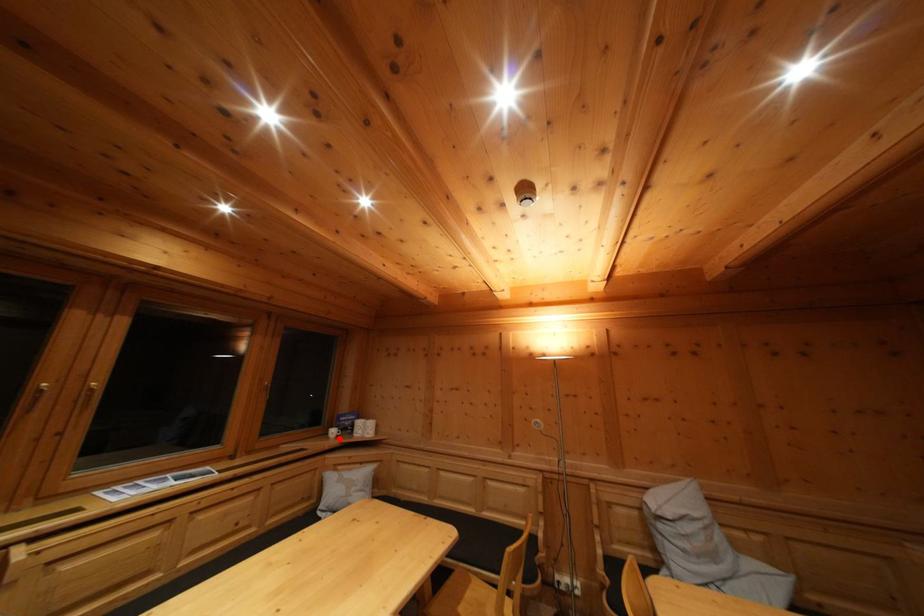
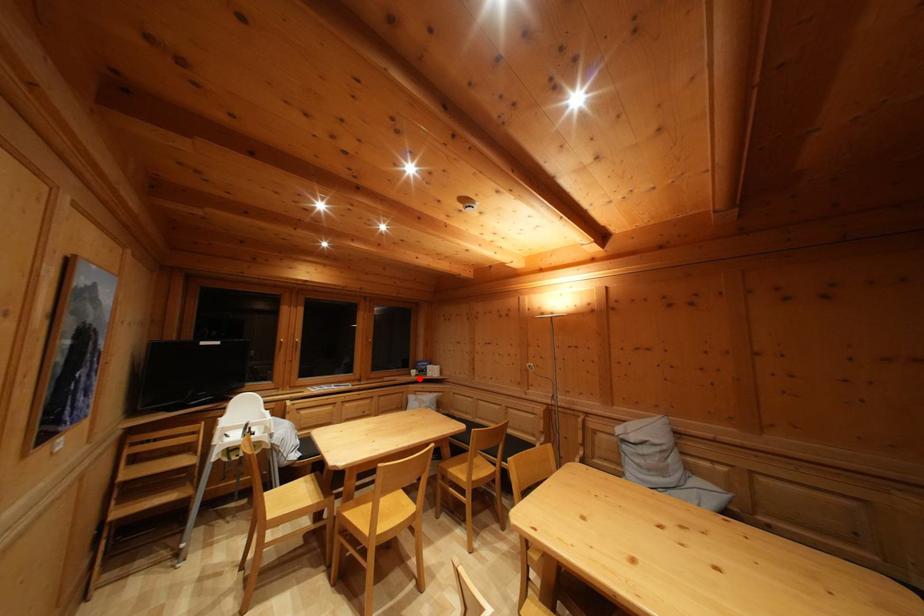
I am providing you with two images of the same scene from different viewpoints. A red point is marked on the first image and another point is marked on the second image. Is the marked point in image1 the same physical position as the marked point in image2?

Yes